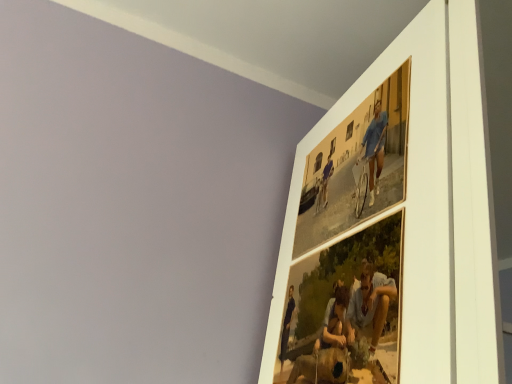
Image resolution: width=512 pixels, height=384 pixels. Describe the element at coordinates (358, 165) in the screenshot. I see `matte paper photo frame at upper right, which is the 1th picture frame from top to bottom` at that location.

This screenshot has width=512, height=384. What are the coordinates of `matte paper photo frame at upper right, which ranks as the 2th picture frame in bottom-to-top order` in the screenshot? It's located at (358, 165).

Based on the photo, how much space does matte wooden photo frame at upper right, which is the first picture frame from bottom to top, occupy horizontally?

matte wooden photo frame at upper right, which is the first picture frame from bottom to top, is 0.50 inches wide.

In order to click on matte wooden photo frame at upper right, which is the first picture frame from bottom to top in this screenshot , I will do `click(346, 308)`.

Image resolution: width=512 pixels, height=384 pixels. Describe the element at coordinates (346, 308) in the screenshot. I see `matte wooden photo frame at upper right, acting as the 2th picture frame starting from the top` at that location.

The width and height of the screenshot is (512, 384). I want to click on matte paper photo frame at upper right, which ranks as the 2th picture frame in bottom-to-top order, so click(x=358, y=165).

From the picture: Which object is positioned more to the right, matte wooden photo frame at upper right, which is the first picture frame from bottom to top, or matte paper photo frame at upper right, which is the 1th picture frame from top to bottom?

From the viewer's perspective, matte paper photo frame at upper right, which is the 1th picture frame from top to bottom, appears more on the right side.

Is matte wooden photo frame at upper right, acting as the 2th picture frame starting from the top, positioned in front of matte paper photo frame at upper right, which is the 1th picture frame from top to bottom?

That is True.

Between point (325, 288) and point (371, 152), which one is positioned behind?

The point (325, 288) is behind.

From the image's perspective, is matte wooden photo frame at upper right, acting as the 2th picture frame starting from the top, positioned above or below matte paper photo frame at upper right, which ranks as the 2th picture frame in bottom-to-top order?

From the image's perspective, matte wooden photo frame at upper right, acting as the 2th picture frame starting from the top, appears below matte paper photo frame at upper right, which ranks as the 2th picture frame in bottom-to-top order.

From a real-world perspective, which object stands above the other?

matte paper photo frame at upper right, which ranks as the 2th picture frame in bottom-to-top order, from a real-world perspective.

Considering the relative sizes of matte wooden photo frame at upper right, acting as the 2th picture frame starting from the top, and matte paper photo frame at upper right, which ranks as the 2th picture frame in bottom-to-top order, in the image provided, is matte wooden photo frame at upper right, acting as the 2th picture frame starting from the top, thinner than matte paper photo frame at upper right, which ranks as the 2th picture frame in bottom-to-top order,?

Incorrect, the width of matte wooden photo frame at upper right, acting as the 2th picture frame starting from the top, is not less than that of matte paper photo frame at upper right, which ranks as the 2th picture frame in bottom-to-top order.

Which of these two, matte wooden photo frame at upper right, acting as the 2th picture frame starting from the top, or matte paper photo frame at upper right, which ranks as the 2th picture frame in bottom-to-top order, stands shorter?

matte wooden photo frame at upper right, acting as the 2th picture frame starting from the top, is shorter.

Considering the relative sizes of matte wooden photo frame at upper right, acting as the 2th picture frame starting from the top, and matte paper photo frame at upper right, which is the 1th picture frame from top to bottom, in the image provided, is matte wooden photo frame at upper right, acting as the 2th picture frame starting from the top, bigger than matte paper photo frame at upper right, which is the 1th picture frame from top to bottom,?

Yes.

Is matte wooden photo frame at upper right, which is the first picture frame from bottom to top, located outside matte paper photo frame at upper right, which ranks as the 2th picture frame in bottom-to-top order?

Yes, matte wooden photo frame at upper right, which is the first picture frame from bottom to top, is located beyond the bounds of matte paper photo frame at upper right, which ranks as the 2th picture frame in bottom-to-top order.

Would you say matte wooden photo frame at upper right, acting as the 2th picture frame starting from the top, is a long distance from matte paper photo frame at upper right, which is the 1th picture frame from top to bottom?

No, matte wooden photo frame at upper right, acting as the 2th picture frame starting from the top, is not far away from matte paper photo frame at upper right, which is the 1th picture frame from top to bottom.

Is matte wooden photo frame at upper right, acting as the 2th picture frame starting from the top, oriented away from matte paper photo frame at upper right, which ranks as the 2th picture frame in bottom-to-top order?

No, matte wooden photo frame at upper right, acting as the 2th picture frame starting from the top,'s orientation is not away from matte paper photo frame at upper right, which ranks as the 2th picture frame in bottom-to-top order.

What's the angular difference between matte wooden photo frame at upper right, acting as the 2th picture frame starting from the top, and matte paper photo frame at upper right, which is the 1th picture frame from top to bottom,'s facing directions?

The angle between the facing direction of matte wooden photo frame at upper right, acting as the 2th picture frame starting from the top, and the facing direction of matte paper photo frame at upper right, which is the 1th picture frame from top to bottom, is 0.00292 degrees.

Measure the distance between matte wooden photo frame at upper right, acting as the 2th picture frame starting from the top, and matte paper photo frame at upper right, which is the 1th picture frame from top to bottom.

matte wooden photo frame at upper right, acting as the 2th picture frame starting from the top, and matte paper photo frame at upper right, which is the 1th picture frame from top to bottom, are 6.15 inches apart.

Where is `picture frame below the matte paper photo frame at upper right, which is the 1th picture frame from top to bottom (from the image's perspective)`? picture frame below the matte paper photo frame at upper right, which is the 1th picture frame from top to bottom (from the image's perspective) is located at coordinates (346, 308).

Between matte paper photo frame at upper right, which is the 1th picture frame from top to bottom, and matte wooden photo frame at upper right, acting as the 2th picture frame starting from the top, which one appears on the left side from the viewer's perspective?

Positioned to the left is matte wooden photo frame at upper right, acting as the 2th picture frame starting from the top.

Considering the positions of objects matte paper photo frame at upper right, which is the 1th picture frame from top to bottom, and matte wooden photo frame at upper right, acting as the 2th picture frame starting from the top, in the image provided, who is in front, matte paper photo frame at upper right, which is the 1th picture frame from top to bottom, or matte wooden photo frame at upper right, acting as the 2th picture frame starting from the top,?

matte wooden photo frame at upper right, acting as the 2th picture frame starting from the top, is more forward.

Does point (362, 110) come farther from viewer compared to point (346, 313)?

Yes, point (362, 110) is behind point (346, 313).

From the image's perspective, would you say matte paper photo frame at upper right, which ranks as the 2th picture frame in bottom-to-top order, is shown under matte wooden photo frame at upper right, acting as the 2th picture frame starting from the top?

No, from the image's perspective, matte paper photo frame at upper right, which ranks as the 2th picture frame in bottom-to-top order, is not below matte wooden photo frame at upper right, acting as the 2th picture frame starting from the top.

Based on the photo, from a real-world perspective, which is physically above, matte paper photo frame at upper right, which is the 1th picture frame from top to bottom, or matte wooden photo frame at upper right, which is the first picture frame from bottom to top?

matte paper photo frame at upper right, which is the 1th picture frame from top to bottom, is physically above.

Which of these two, matte paper photo frame at upper right, which ranks as the 2th picture frame in bottom-to-top order, or matte wooden photo frame at upper right, which is the first picture frame from bottom to top, is thinner?

With smaller width is matte paper photo frame at upper right, which ranks as the 2th picture frame in bottom-to-top order.

Between matte paper photo frame at upper right, which ranks as the 2th picture frame in bottom-to-top order, and matte wooden photo frame at upper right, acting as the 2th picture frame starting from the top, which one has more height?

Standing taller between the two is matte paper photo frame at upper right, which ranks as the 2th picture frame in bottom-to-top order.

Which of these two, matte paper photo frame at upper right, which is the 1th picture frame from top to bottom, or matte wooden photo frame at upper right, acting as the 2th picture frame starting from the top, is bigger?

With larger size is matte wooden photo frame at upper right, acting as the 2th picture frame starting from the top.

Is matte paper photo frame at upper right, which ranks as the 2th picture frame in bottom-to-top order, surrounding matte wooden photo frame at upper right, which is the first picture frame from bottom to top?

Actually, matte wooden photo frame at upper right, which is the first picture frame from bottom to top, is outside matte paper photo frame at upper right, which ranks as the 2th picture frame in bottom-to-top order.

Are matte paper photo frame at upper right, which ranks as the 2th picture frame in bottom-to-top order, and matte wooden photo frame at upper right, which is the first picture frame from bottom to top, located far from each other?

That's not correct — matte paper photo frame at upper right, which ranks as the 2th picture frame in bottom-to-top order, is a little close to matte wooden photo frame at upper right, which is the first picture frame from bottom to top.

Is matte paper photo frame at upper right, which ranks as the 2th picture frame in bottom-to-top order, positioned with its back to matte wooden photo frame at upper right, which is the first picture frame from bottom to top?

That's not correct — matte paper photo frame at upper right, which ranks as the 2th picture frame in bottom-to-top order, is not looking away from matte wooden photo frame at upper right, which is the first picture frame from bottom to top.

From the picture: How distant is matte paper photo frame at upper right, which is the 1th picture frame from top to bottom, from matte wooden photo frame at upper right, acting as the 2th picture frame starting from the top?

matte paper photo frame at upper right, which is the 1th picture frame from top to bottom, is 6.15 inches from matte wooden photo frame at upper right, acting as the 2th picture frame starting from the top.

This screenshot has width=512, height=384. I want to click on picture frame that is above the matte wooden photo frame at upper right, which is the first picture frame from bottom to top (from the image's perspective), so click(x=358, y=165).

Where is `picture frame directly beneath the matte paper photo frame at upper right, which is the 1th picture frame from top to bottom (from a real-world perspective)`? picture frame directly beneath the matte paper photo frame at upper right, which is the 1th picture frame from top to bottom (from a real-world perspective) is located at coordinates (346, 308).

Find the location of a particular element. This screenshot has height=384, width=512. picture frame that is behind the matte wooden photo frame at upper right, acting as the 2th picture frame starting from the top is located at coordinates (358, 165).